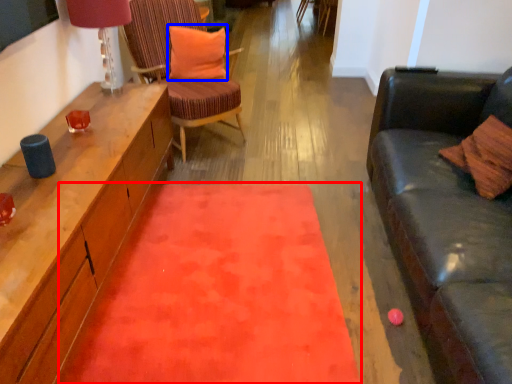
Question: Which object is closer to the camera taking this photo, mat (highlighted by a red box) or pillow (highlighted by a blue box)?

Choices:
 (A) mat
 (B) pillow

Answer: (A)